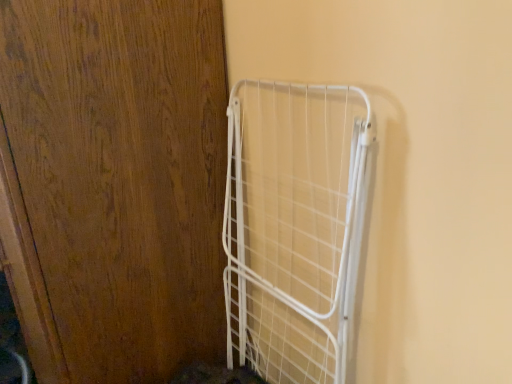
The height and width of the screenshot is (384, 512). Describe the element at coordinates (114, 184) in the screenshot. I see `wooden door at left` at that location.

Image resolution: width=512 pixels, height=384 pixels. What are the coordinates of `wooden door at left` in the screenshot? It's located at (114, 184).

Where is `white wire cage at right`? The height and width of the screenshot is (384, 512). white wire cage at right is located at coordinates (295, 227).

What do you see at coordinates (295, 227) in the screenshot?
I see `white wire cage at right` at bounding box center [295, 227].

Image resolution: width=512 pixels, height=384 pixels. Find the location of `wooden door at left`. wooden door at left is located at coordinates (114, 184).

In the image, is white wire cage at right on the left side or the right side of wooden door at left?

Based on their positions, white wire cage at right is located to the right of wooden door at left.

Relative to wooden door at left, is white wire cage at right in front or behind?

white wire cage at right is behind wooden door at left.

Which is in front, point (293, 329) or point (184, 149)?

The point (184, 149) is closer.

From the image's perspective, relative to wooden door at left, is white wire cage at right above or below?

Clearly, from the image's perspective, white wire cage at right is below wooden door at left.

From a real-world perspective, does white wire cage at right stand above wooden door at left?

No, from a real-world perspective, white wire cage at right is not above wooden door at left.

Considering the relative sizes of white wire cage at right and wooden door at left in the image provided, is white wire cage at right wider than wooden door at left?

Incorrect, the width of white wire cage at right does not surpass that of wooden door at left.

Considering the sizes of objects white wire cage at right and wooden door at left in the image provided, who is taller, white wire cage at right or wooden door at left?

Standing taller between the two is wooden door at left.

In terms of size, does white wire cage at right appear bigger or smaller than wooden door at left?

white wire cage at right is smaller than wooden door at left.

Is wooden door at left located within white wire cage at right?

No.

Are white wire cage at right and wooden door at left far apart?

No, white wire cage at right is not far from wooden door at left.

Is wooden door at left at the back of white wire cage at right?

white wire cage at right is not turned away from wooden door at left.

How different are the orientations of white wire cage at right and wooden door at left in degrees?

There is a 0.436-degree angle between the facing directions of white wire cage at right and wooden door at left.

How distant is white wire cage at right from wooden door at left?

A distance of 10.44 inches exists between white wire cage at right and wooden door at left.

Locate an element on the screen. This screenshot has height=384, width=512. door above the white wire cage at right (from the image's perspective) is located at coordinates (114, 184).

Which object is positioned more to the right, wooden door at left or white wire cage at right?

From the viewer's perspective, white wire cage at right appears more on the right side.

In the scene shown: Relative to white wire cage at right, is wooden door at left in front or behind?

In the image, wooden door at left appears in front of white wire cage at right.

Does point (53, 377) appear closer or farther from the camera than point (242, 194)?

Clearly, point (53, 377) is closer to the camera than point (242, 194).

From the image's perspective, which is below, wooden door at left or white wire cage at right?

white wire cage at right is shown below in the image.

From a real-world perspective, is wooden door at left positioned over white wire cage at right based on gravity?

Yes, from a real-world perspective, wooden door at left is over white wire cage at right

Between wooden door at left and white wire cage at right, which one has smaller width?

Thinner between the two is white wire cage at right.

From their relative heights in the image, would you say wooden door at left is taller or shorter than white wire cage at right?

wooden door at left is taller than white wire cage at right.

Does wooden door at left have a larger size compared to white wire cage at right?

Correct, wooden door at left is larger in size than white wire cage at right.

Do you think wooden door at left is within white wire cage at right, or outside of it?

The correct answer is: outside.

Is wooden door at left next to white wire cage at right and touching it?

There is a gap between wooden door at left and white wire cage at right.

Could you tell me if wooden door at left is turned towards white wire cage at right?

No.

How different are the orientations of wooden door at left and white wire cage at right in degrees?

The facing directions of wooden door at left and white wire cage at right are 0.436 degrees apart.

I want to click on cage on the right of wooden door at left, so click(x=295, y=227).

This screenshot has height=384, width=512. In order to click on cage located below the wooden door at left (from the image's perspective) in this screenshot , I will do `click(295, 227)`.

In the image, there is a wooden door at left. Where is `cage below it (from a real-world perspective)`? The width and height of the screenshot is (512, 384). cage below it (from a real-world perspective) is located at coordinates (295, 227).